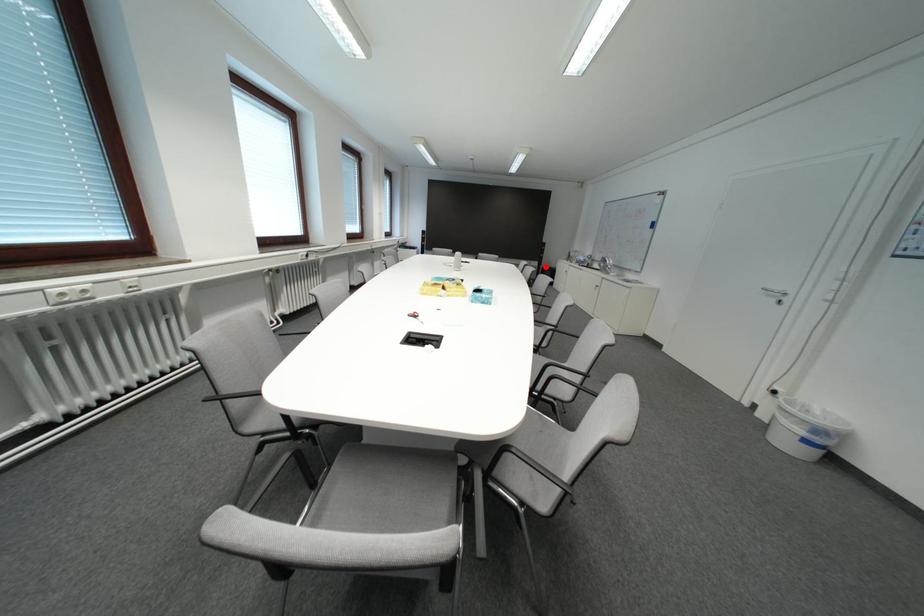
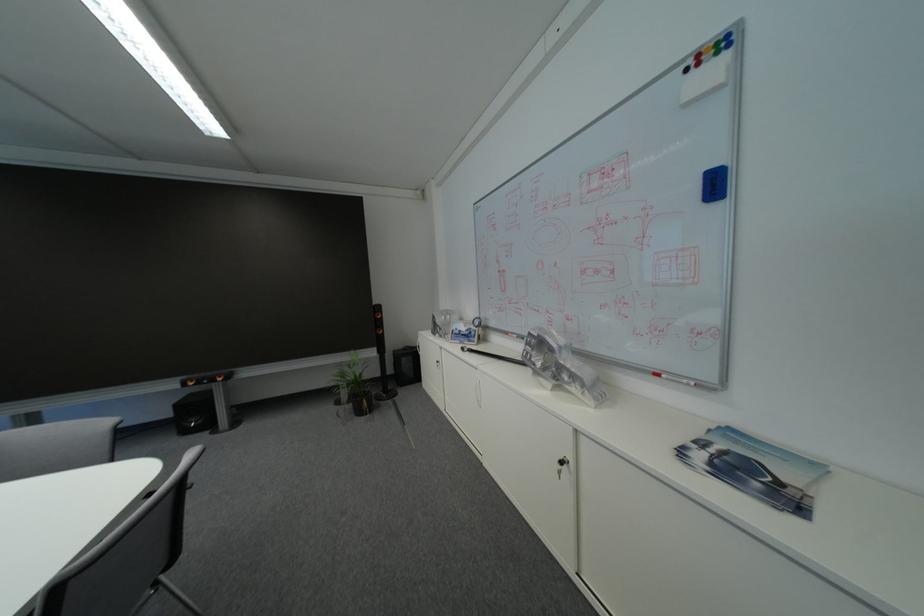
Question: I am providing you with two images of the same scene from different viewpoints. In image1, a red point is highlighted. Considering the same 3D point in image2, which of the following is correct?

Choices:
 (A) It is closer
 (B) It is farther

Answer: (A)